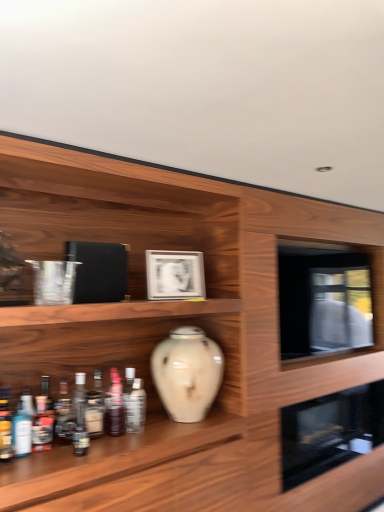
Question: From a real-world perspective, is matte silver picture frame at center below white glossy vase at center?

Choices:
 (A) yes
 (B) no

Answer: (B)

Question: From the image's perspective, is matte silver picture frame at center on white glossy vase at center?

Choices:
 (A) no
 (B) yes

Answer: (B)

Question: Are matte silver picture frame at center and white glossy vase at center located far from each other?

Choices:
 (A) yes
 (B) no

Answer: (B)

Question: Can you confirm if matte silver picture frame at center is bigger than white glossy vase at center?

Choices:
 (A) yes
 (B) no

Answer: (B)

Question: Can you confirm if matte silver picture frame at center is positioned to the left of white glossy vase at center?

Choices:
 (A) no
 (B) yes

Answer: (B)

Question: Choose the correct answer: Is black glass oven at lower right, marked as the 2th oven in a top-to-bottom arrangement, inside translucent glass bottle at lower left, acting as the 6th bottle starting from the right, or outside it?

Choices:
 (A) inside
 (B) outside

Answer: (B)

Question: Is black glass oven at lower right, marked as the 2th oven in a top-to-bottom arrangement, wider or thinner than translucent glass bottle at lower left, which is counted as the third bottle, starting from the left?

Choices:
 (A) wide
 (B) thin

Answer: (A)

Question: In terms of size, does black glass oven at lower right, arranged as the 1th oven when ordered from the bottom, appear bigger or smaller than translucent glass bottle at lower left, acting as the 6th bottle starting from the right?

Choices:
 (A) big
 (B) small

Answer: (A)

Question: From a real-world perspective, is black glass oven at lower right, marked as the 2th oven in a top-to-bottom arrangement, physically located above or below translucent glass bottle at lower left, which is counted as the third bottle, starting from the left?

Choices:
 (A) below
 (B) above

Answer: (A)

Question: Is translucent glass bottle at lower left, which appears as the 8th bottle when viewed from the right, in front of or behind translucent glass bottle at lower left, the 5th bottle when ordered from left to right, in the image?

Choices:
 (A) front
 (B) behind

Answer: (A)

Question: From the image's perspective, is translucent glass bottle at lower left, which appears as the 8th bottle when viewed from the right, positioned above or below translucent glass bottle at lower left, placed as the 4th bottle when sorted from right to left?

Choices:
 (A) above
 (B) below

Answer: (B)

Question: Is translucent glass bottle at lower left, placed as the 1th bottle when sorted from left to right, taller or shorter than translucent glass bottle at lower left, the 5th bottle when ordered from left to right?

Choices:
 (A) tall
 (B) short

Answer: (A)

Question: Is translucent glass bottle at lower left, which appears as the 8th bottle when viewed from the right, spatially inside translucent glass bottle at lower left, the 5th bottle when ordered from left to right, or outside of it?

Choices:
 (A) inside
 (B) outside

Answer: (B)

Question: Would you say translucent plastic bottle at center, the 1th bottle from the right, is to the left or to the right of translucent glass bottle at lower left, which is counted as the second bottle, starting from the right, in the picture?

Choices:
 (A) left
 (B) right

Answer: (B)

Question: Is translucent plastic bottle at center, acting as the 8th bottle starting from the left, bigger or smaller than translucent glass bottle at lower left, positioned as the 7th bottle in left-to-right order?

Choices:
 (A) big
 (B) small

Answer: (A)